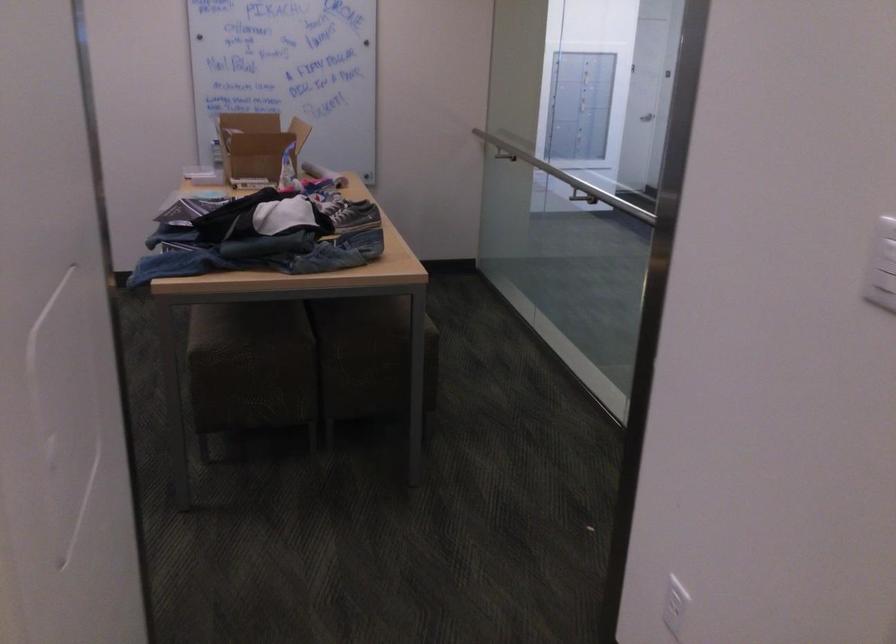
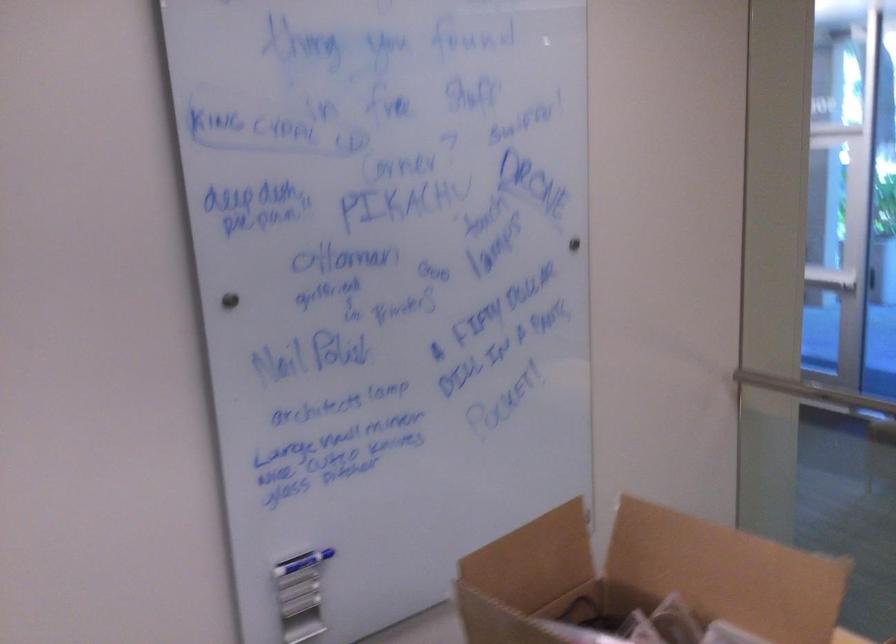
In a continuous first-person perspective shot, in which direction is the camera moving?

The movement direction of the cameraman is left, forward.